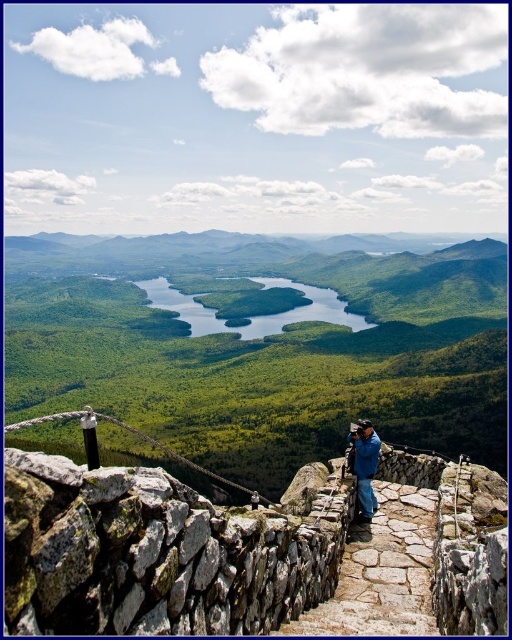
You are a hiker standing at the top of the mountain looking down at the scene. You see the green grassy valley at center and the blue glossy water at center. Which one appears higher in the image?

The green grassy valley at center appears higher than the blue glossy water at center because it is taller than it.